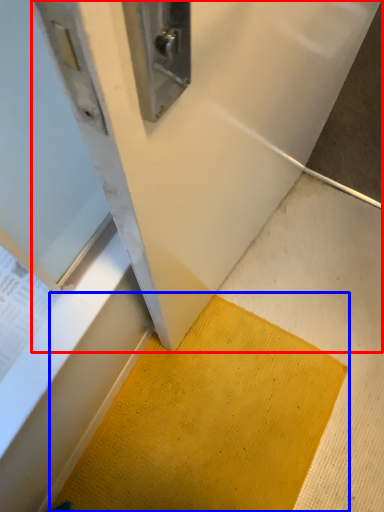
Question: Which of the following is the farthest to the observer, wide (highlighted by a red box) or doormat (highlighted by a blue box)?

Choices:
 (A) wide
 (B) doormat

Answer: (B)